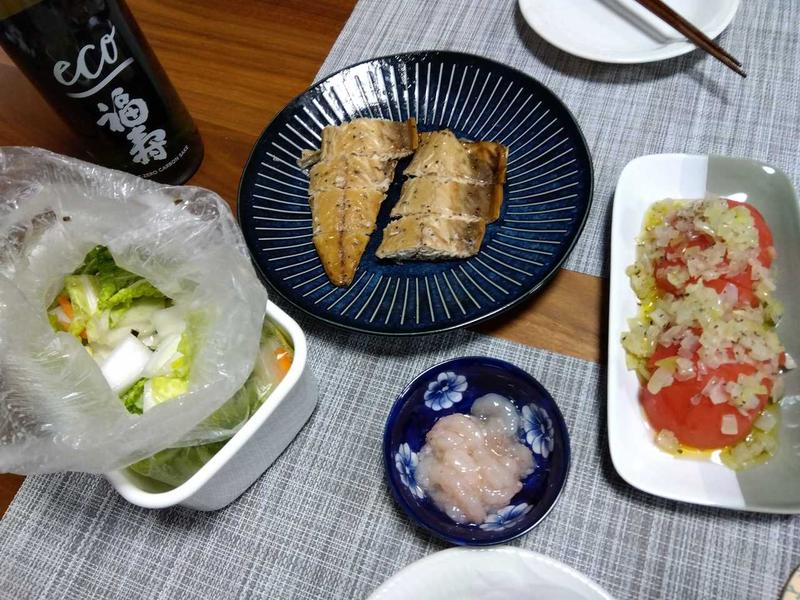
Find the location of `plates`. plates is located at coordinates (633, 36), (642, 460), (518, 567), (464, 304).